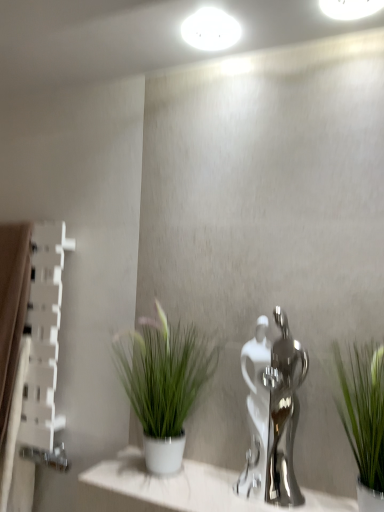
I want to click on free space underneath green matte plant at center, which is counted as the first houseplant, starting from the left (from a real-world perspective), so click(169, 472).